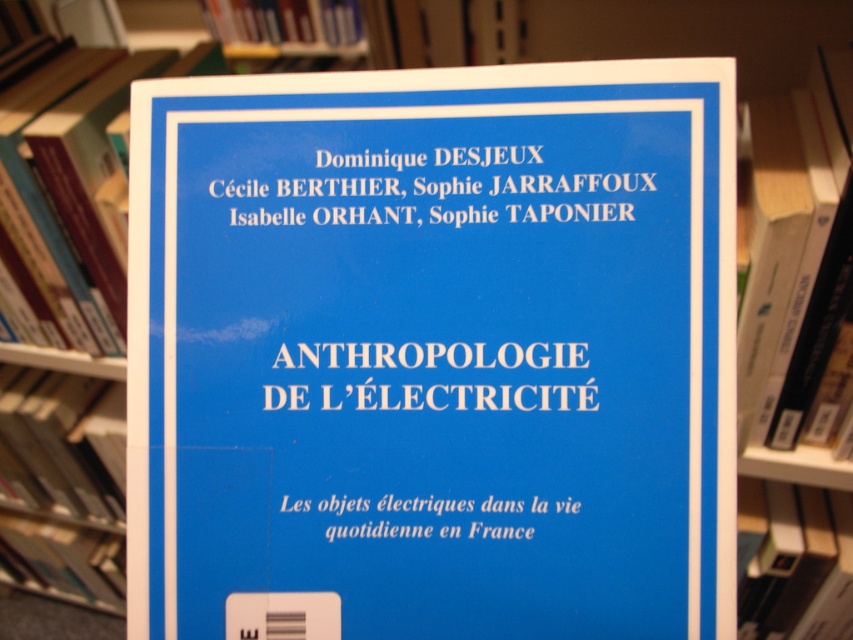
Is blue hardcover book at center shorter than white paper at center?

In fact, blue hardcover book at center may be taller than white paper at center.

Is point (762, 604) positioned before point (523, 536)?

No, it is not.

The height and width of the screenshot is (640, 853). In order to click on blue hardcover book at center in this screenshot , I will do `click(799, 566)`.

Can you confirm if white text at upper center is taller than white paper at center?

Yes.

Which of these two, white text at upper center or white paper at center, stands shorter?

With less height is white paper at center.

Between point (596, 173) and point (496, 529), which one is positioned behind?

The point (596, 173) is behind.

At what (x,y) coordinates should I click in order to perform the action: click on white text at upper center. Please return your answer as a coordinate pair (x, y). This screenshot has width=853, height=640. Looking at the image, I should click on (532, 182).

Is blue matte book at left taller than blue hardcover book at upper center?

Yes.

Between point (12, 392) and point (238, 33), which one is positioned in front?

Point (238, 33)

Locate an element on the screen. Image resolution: width=853 pixels, height=640 pixels. blue matte book at left is located at coordinates (53, 436).